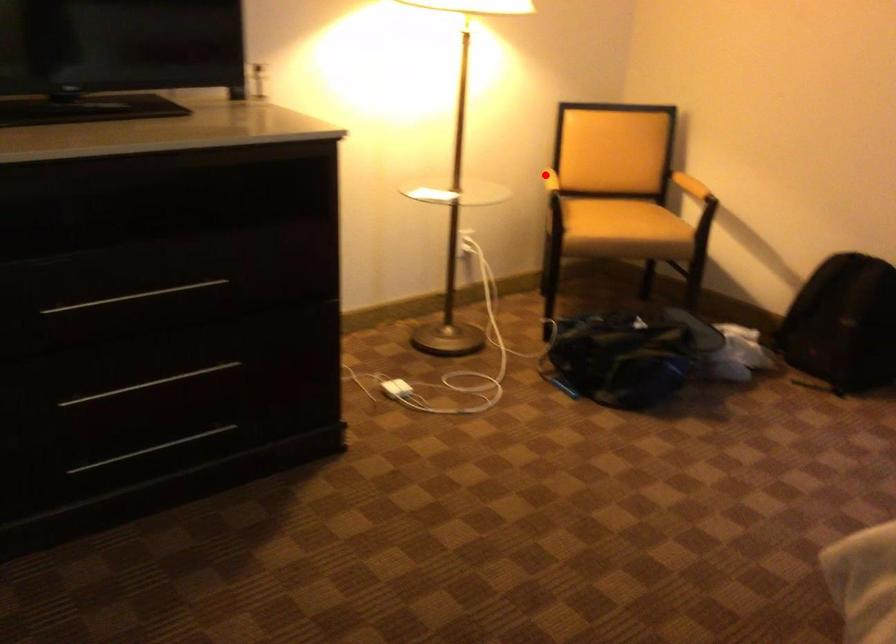
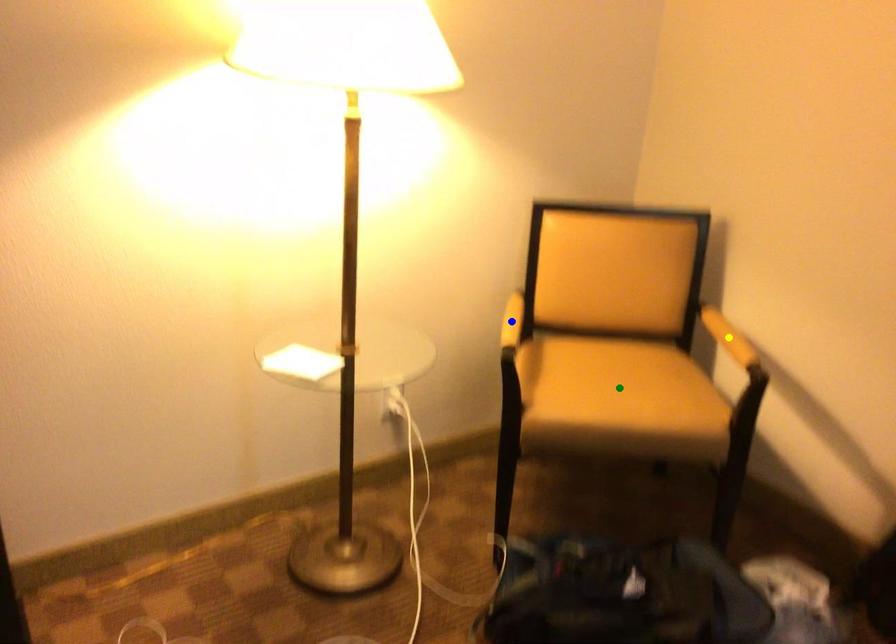
Question: I am providing you with two images of the same scene from different viewpoints. A red point is marked on the first image. You are given multiple points on the second image. Which point in image 2 represents the same 3d spot as the red point in image 1?

Choices:
 (A) yellow point
 (B) green point
 (C) blue point

Answer: (C)